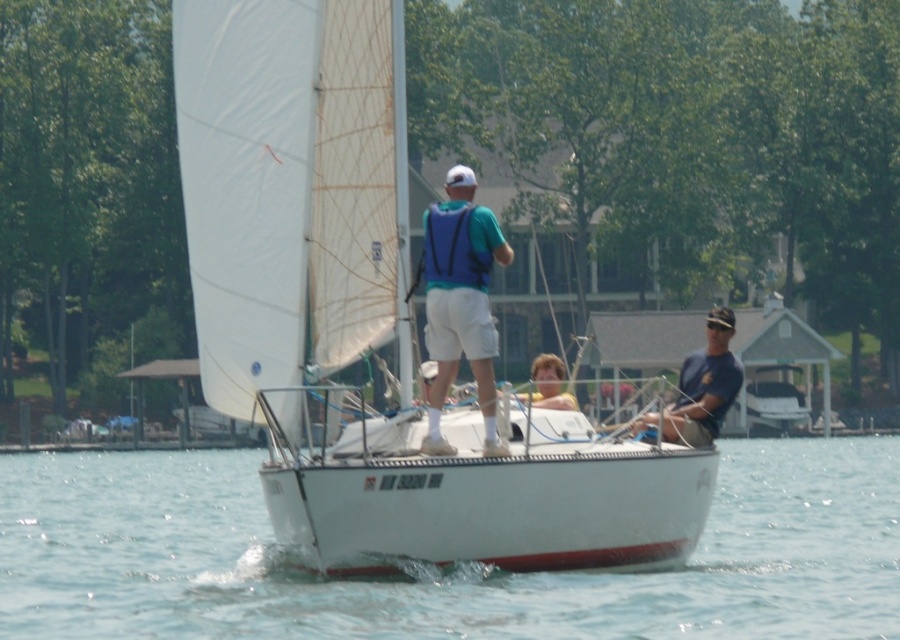
At what (x,y) coordinates should I click in order to perform the action: click on clear blue water at center. Please return your answer as a coordinate pair (x, y). Looking at the image, I should click on (437, 568).

Is the position of clear blue water at center less distant than that of matte blue vest at center?

Yes, clear blue water at center is in front of matte blue vest at center.

Which is in front, point (544, 632) or point (435, 292)?

Point (544, 632) is more forward.

What are the coordinates of `clear blue water at center` in the screenshot? It's located at (437, 568).

Consider the image. Is matte blue vest at center below smooth blonde hair at center?

No, matte blue vest at center is not below smooth blonde hair at center.

Who is shorter, matte blue vest at center or smooth blonde hair at center?

With less height is smooth blonde hair at center.

This screenshot has width=900, height=640. In order to click on matte blue vest at center in this screenshot , I will do `click(461, 301)`.

Does clear blue water at center appear on the left side of smooth blonde hair at center?

Yes, clear blue water at center is to the left of smooth blonde hair at center.

Is clear blue water at center wider than smooth blonde hair at center?

Yes.

Identify the location of clear blue water at center. The width and height of the screenshot is (900, 640). click(x=437, y=568).